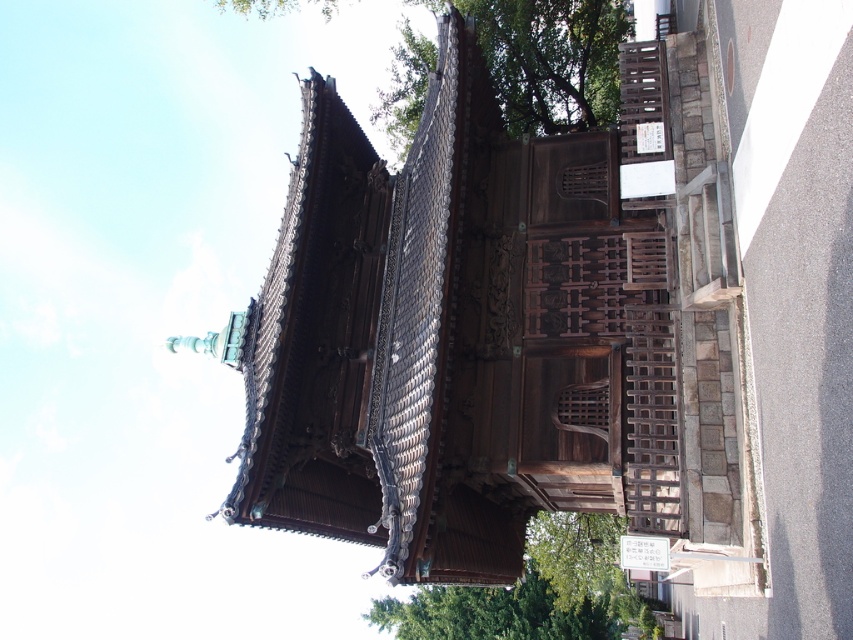
You are standing in front of the traditional Japanese gate and notice two green leafy trees. One is labeled as the green leafy tree at upper center and the other as the green leafy tree at lower left. From your vantage point, which tree is positioned to the left of the other?

The green leafy tree at upper center is to the left of the green leafy tree at lower left.